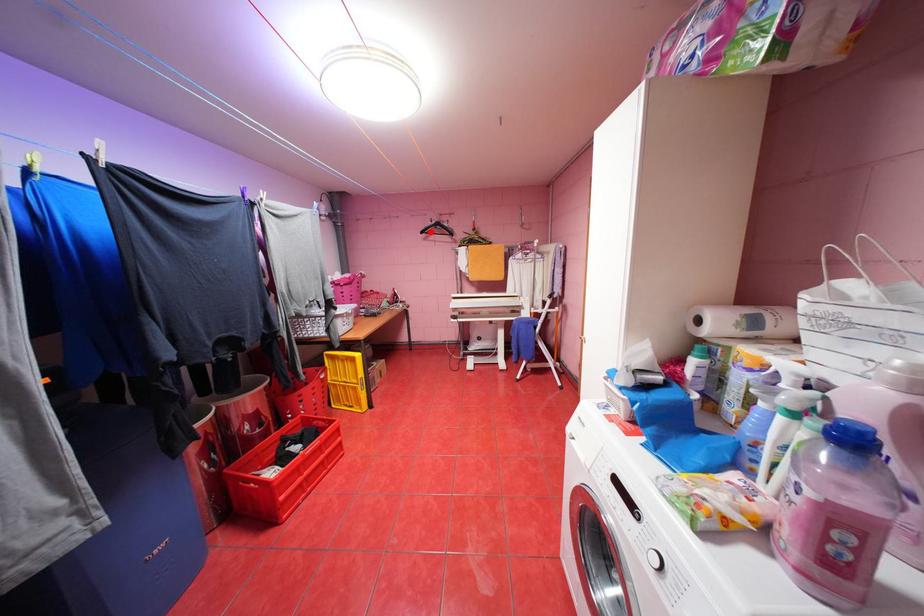
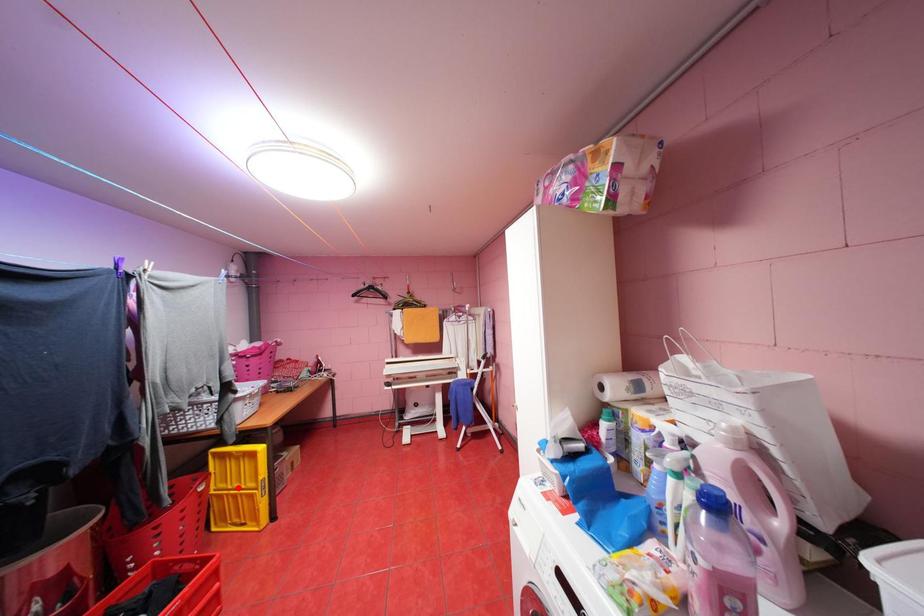
Based on the photo, I am providing you with two images of the same scene from different viewpoints. A red point is marked on the first image and another point is marked on the second image. Is the marked point in image1 the same physical position as the marked point in image2?

No